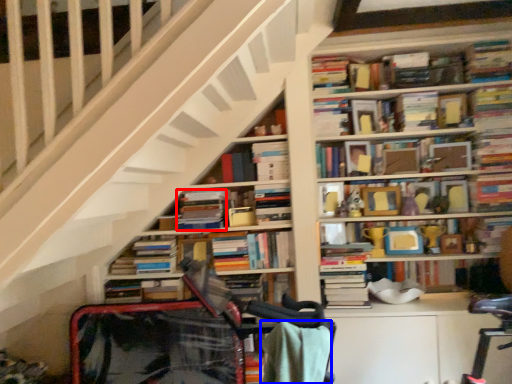
Question: Which point is closer to the camera, book (highlighted by a red box) or blanket (highlighted by a blue box)?

Choices:
 (A) book
 (B) blanket

Answer: (B)